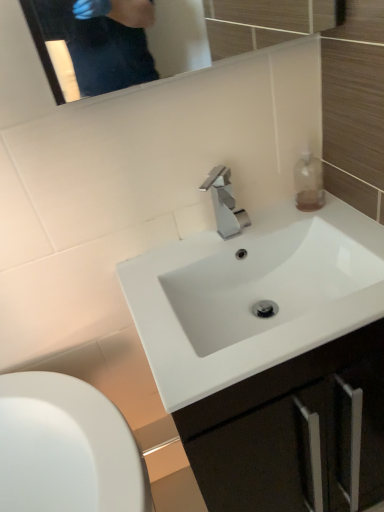
Where is `free location in front of translucent glass bottle at upper right`? free location in front of translucent glass bottle at upper right is located at coordinates (331, 226).